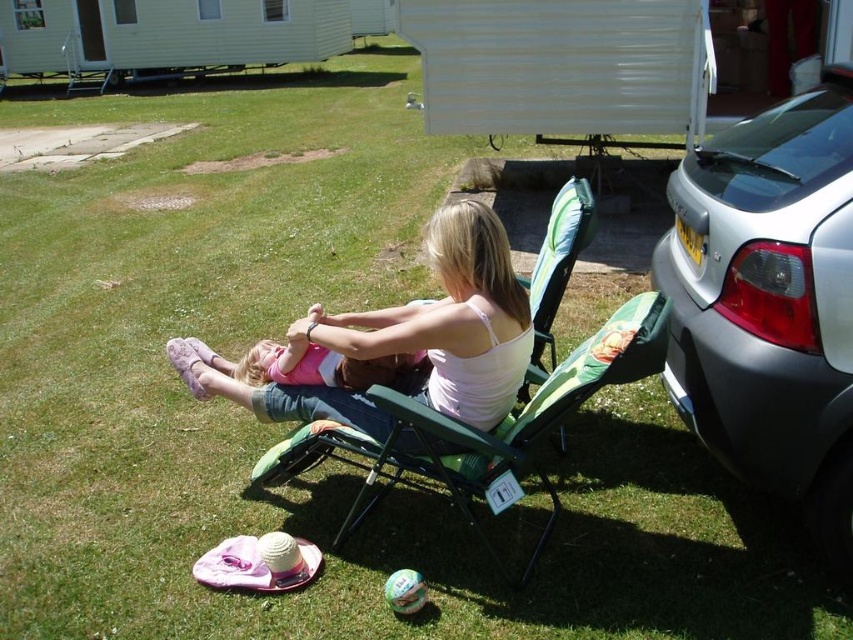
Is green fabric chair at center closer to the viewer compared to pink fabric baby at center?

That is True.

Is green fabric chair at center below pink fabric baby at center?

Correct, green fabric chair at center is located below pink fabric baby at center.

The width and height of the screenshot is (853, 640). Describe the element at coordinates (479, 432) in the screenshot. I see `green fabric chair at center` at that location.

Where is `green fabric chair at center`? green fabric chair at center is located at coordinates (479, 432).

Which is in front, point (846, 438) or point (384, 378)?

Point (846, 438) is more forward.

Is silver metallic car at right bigger than pink fabric baby at center?

Yes, silver metallic car at right is bigger than pink fabric baby at center.

Where is `silver metallic car at right`? The height and width of the screenshot is (640, 853). silver metallic car at right is located at coordinates (769, 304).

Identify the location of silver metallic car at right. (769, 304).

Describe the element at coordinates (450, 321) in the screenshot. Image resolution: width=853 pixels, height=640 pixels. I see `pink fabric dress at center` at that location.

Which of these two, pink fabric dress at center or pink fabric baby at center, stands taller?

pink fabric dress at center is taller.

Is point (433, 404) behind point (410, 355)?

That is False.

Image resolution: width=853 pixels, height=640 pixels. I want to click on pink fabric dress at center, so click(x=450, y=321).